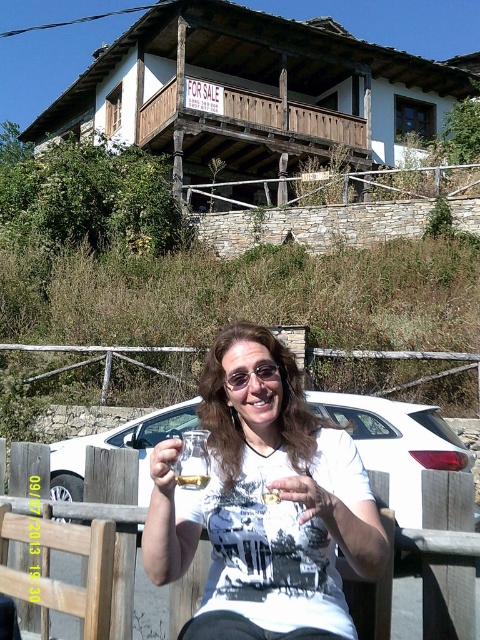
Question: Which point is farther to the camera?

Choices:
 (A) clear glass wine glass at center
 (B) translucent glass at center

Answer: (A)

Question: Which point is closer to the camera taking this photo?

Choices:
 (A) (445, 467)
 (B) (201, 488)
 (C) (252, 353)

Answer: (B)

Question: Which of the following is the closest to the observer?

Choices:
 (A) (312, 520)
 (B) (175, 476)
 (C) (474, 508)

Answer: (B)

Question: Does white glossy car at center appear over clear glass wine glass at center?

Choices:
 (A) yes
 (B) no

Answer: (B)

Question: In this image, where is white glossy car at center located relative to clear glass wine glass at center?

Choices:
 (A) above
 (B) below

Answer: (B)

Question: Can you confirm if white glossy car at center is thinner than clear glass wine glass at center?

Choices:
 (A) yes
 (B) no

Answer: (B)